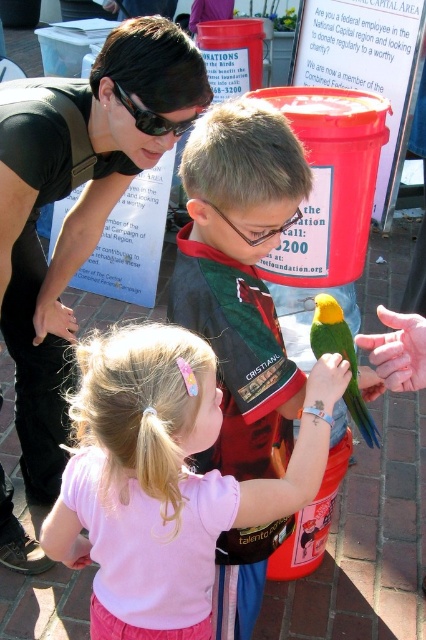
Question: Which object appears closest to the camera in this image?

Choices:
 (A) pale pink fabric at center
 (B) black plastic goggles at upper center

Answer: (A)

Question: Does pale pink fabric at center appear on the right side of green matte parrot at center?

Choices:
 (A) no
 (B) yes

Answer: (A)

Question: Where is pale pink fabric at center located in relation to black plastic goggles at upper center in the image?

Choices:
 (A) above
 (B) below

Answer: (B)

Question: Is green matte parrot at center to the left of black plastic goggles at upper center from the viewer's perspective?

Choices:
 (A) yes
 (B) no

Answer: (B)

Question: Which point is closer to the camera taking this photo?

Choices:
 (A) (164, 116)
 (B) (173, 618)
 (C) (69, 253)

Answer: (B)

Question: Which object is positioned closest to the clear plastic goggles at center?

Choices:
 (A) black plastic goggles at upper center
 (B) green matte parrot at center
 (C) pale pink fabric at center
 (D) matte black shirt at upper left

Answer: (B)